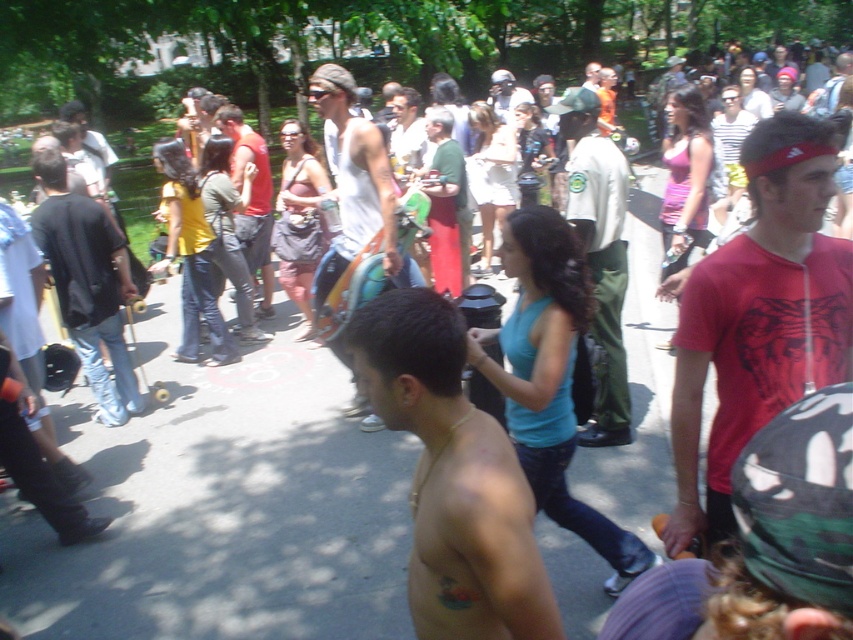
Does white tank top at center lie behind matte red tank top at center?

No, it is in front of matte red tank top at center.

Is point (352, 141) farther from camera compared to point (257, 141)?

No.

You are a GUI agent. You are given a task and a screenshot of the screen. Output one action in this format:
    pyautogui.click(x=<x>, y=<y>)
    Task: Click on the white tank top at center
    Image resolution: width=853 pixels, height=640 pixels.
    Given the screenshot: What is the action you would take?
    pyautogui.click(x=357, y=188)

Can you confirm if black cotton shirt at left is wider than matte red tank top at center?

No, black cotton shirt at left is not wider than matte red tank top at center.

Can you confirm if black cotton shirt at left is positioned above matte red tank top at center?

Actually, black cotton shirt at left is below matte red tank top at center.

Who is more forward, [68,292] or [265,212]?

Point [68,292] is more forward.

Identify the location of black cotton shirt at left. The image size is (853, 640). [86, 284].

Does shiny gold necklace at center have a greater width compared to matte red tank top at center?

In fact, shiny gold necklace at center might be narrower than matte red tank top at center.

Based on the photo, which of these two, shiny gold necklace at center or matte red tank top at center, stands shorter?

shiny gold necklace at center is shorter.

Locate an element on the screen. The image size is (853, 640). shiny gold necklace at center is located at coordinates click(453, 477).

Locate an element on the screen. The image size is (853, 640). shiny gold necklace at center is located at coordinates coord(453,477).